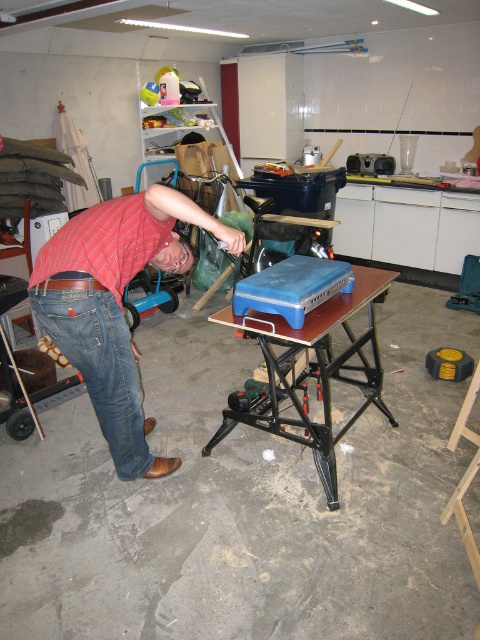
You are organizing the workshop and need to place a large box that requires a surface bigger than the denim at left. Is the blue plastic table at center suitable for this?

The blue plastic table at center has a larger size compared to denim at left, so it is suitable for placing the large box that requires a surface bigger than the denim at left.

In the scene shown: You are a person who is 1.7 meters tall. You are standing in the workshop and see the blue plastic table at center and denim at left. Which object is taller than your knee height of 0.6 meters?

The blue plastic table at center is taller than the denim at left, so the blue plastic table at center is taller than your knee height of 0.6 meters.

You are a delivery person who just arrived at the workshop. You need to place a new tool on the workbench. The workbench is at the center of the image. Where should you place the new tool so that it is closest to the red striped shirt at lower left?

Place the new tool near the lower left side of the workbench since the red striped shirt at lower left is located at point (115, 305), which is closer to the lower left area of the workbench.